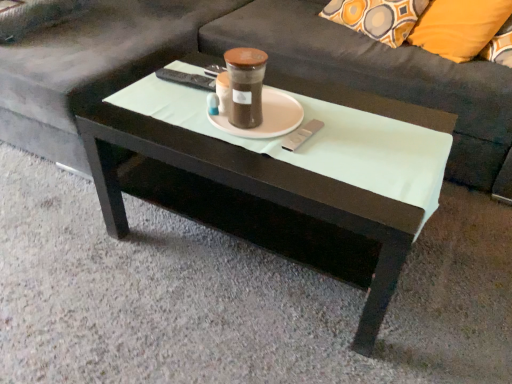
Where is `vacant region to the left of brown matte glass jar at center`? This screenshot has width=512, height=384. vacant region to the left of brown matte glass jar at center is located at coordinates (183, 125).